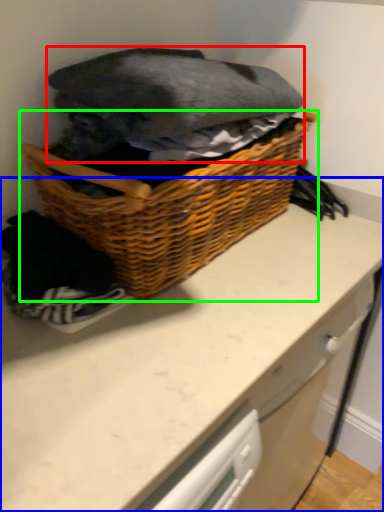
Question: Considering the real-world distances, which object is closest to clothing (highlighted by a red box)? counter (highlighted by a blue box) or picnic basket (highlighted by a green box).

Choices:
 (A) counter
 (B) picnic basket

Answer: (B)